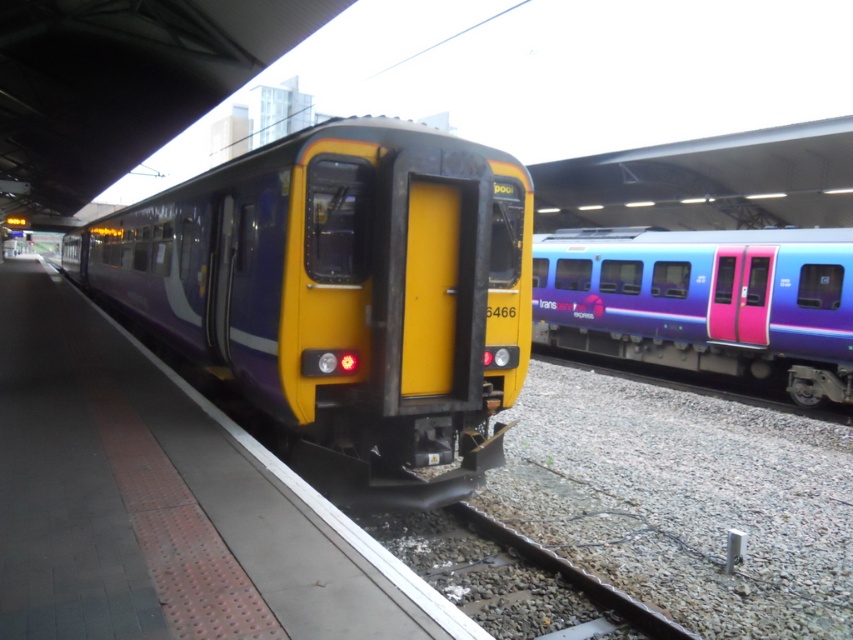
Does blue glossy train at right have a greater height compared to gravel at center?

Indeed, blue glossy train at right has a greater height compared to gravel at center.

The height and width of the screenshot is (640, 853). Describe the element at coordinates (704, 301) in the screenshot. I see `blue glossy train at right` at that location.

Where is `blue glossy train at right`? Image resolution: width=853 pixels, height=640 pixels. blue glossy train at right is located at coordinates (704, 301).

I want to click on blue glossy train at right, so click(x=704, y=301).

Does purple glossy platform at center have a lesser width compared to blue glossy train at right?

Incorrect, purple glossy platform at center's width is not less than blue glossy train at right's.

Is purple glossy platform at center wider than blue glossy train at right?

Correct, the width of purple glossy platform at center exceeds that of blue glossy train at right.

This screenshot has width=853, height=640. Identify the location of purple glossy platform at center. (161, 500).

Find the location of a particular element. The image size is (853, 640). purple glossy platform at center is located at coordinates (161, 500).

How far apart are matte purple train at center and gravel at center?

A distance of 18.66 feet exists between matte purple train at center and gravel at center.

Does matte purple train at center appear under gravel at center?

Incorrect, matte purple train at center is not positioned below gravel at center.

Does point (477, 193) lie in front of point (509, 600)?

No.

Where is `matte purple train at center`? The width and height of the screenshot is (853, 640). matte purple train at center is located at coordinates (341, 296).